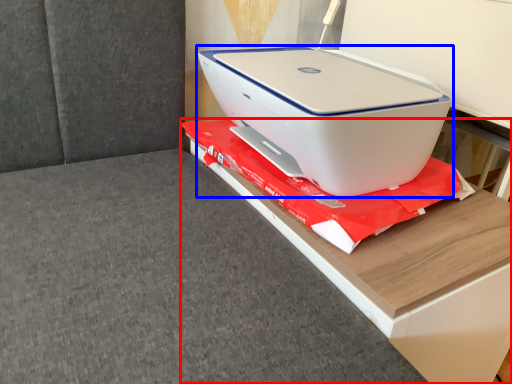
Question: Which object is closer to the camera taking this photo, furniture (highlighted by a red box) or printer (highlighted by a blue box)?

Choices:
 (A) furniture
 (B) printer

Answer: (A)